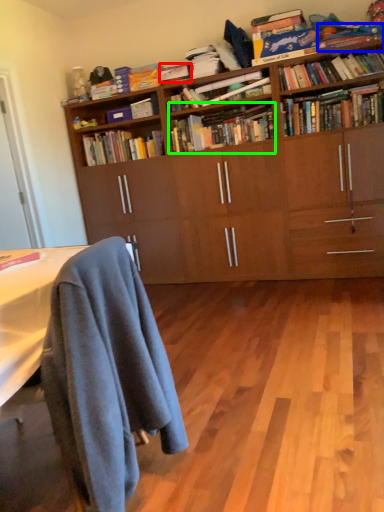
Question: Which is nearer to the book (highlighted by a red box)? book (highlighted by a blue box) or book (highlighted by a green box).

Choices:
 (A) book
 (B) book

Answer: (B)